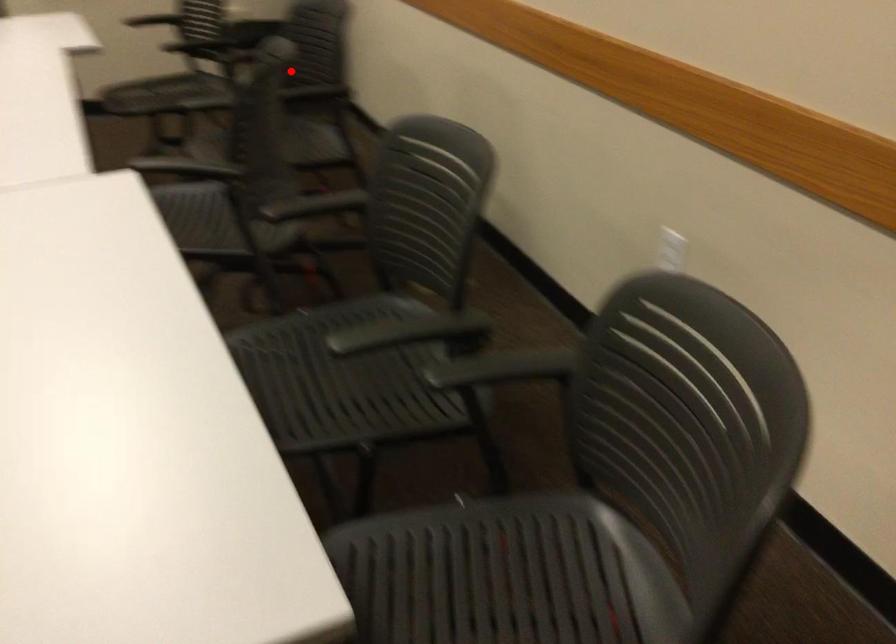
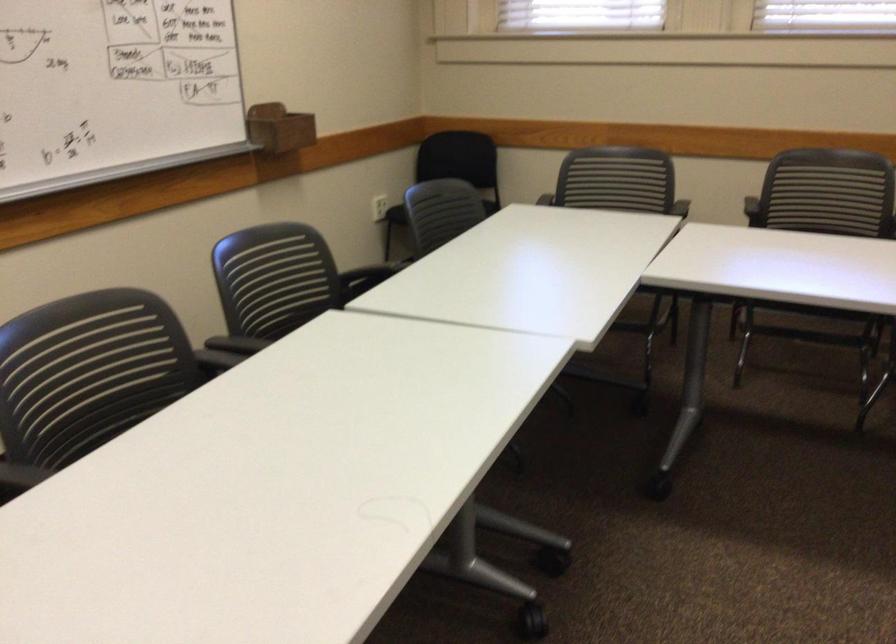
Find the pixel in the second image that matches the highlighted location in the first image.

(828, 200)